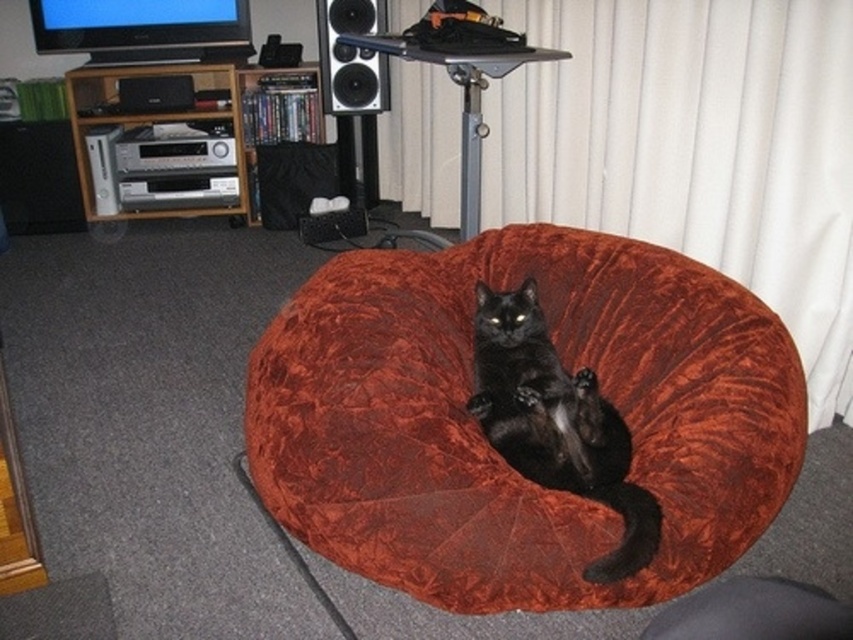
You are a photographer standing at a certain distance from the velvet orange bean bag chair at center. You want to capture a closeup shot of the chair without any distortion. Considering the camera lens you have can focus as close as 4 feet, will you be able to achieve this?

The distance between you and the velvet orange bean bag chair at center is 4.62 feet. Since your camera lens can focus as close as 4 feet, you are 0.62 feet farther than the minimum focusing distance. To avoid distortion, you need to move closer to ensure the distance is within the 4 feet range.

You are a guest in this living room and want to sit down on the velvet orange bean bag chair at center. However, you notice the black fabric speaker at center might be in the way. Is the speaker above or below the bean bag chair?

The velvet orange bean bag chair at center is positioned under the black fabric speaker at center, meaning the speaker is above the bean bag chair.